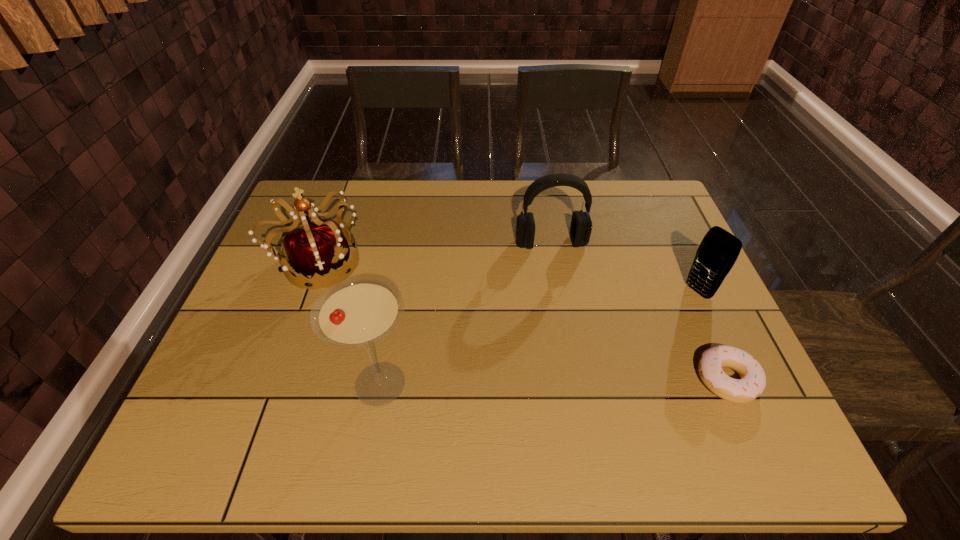
Find the location of a particular element. The width and height of the screenshot is (960, 540). free space on the desktop that is between the fourth object from right to left and the shortest object and is positioned on the front-facing side of the leftmost object is located at coordinates (547, 382).

You are a GUI agent. You are given a task and a screenshot of the screen. Output one action in this format:
    pyautogui.click(x=<x>, y=<y>)
    Task: Click on the free spot on the desktop that is between the fourth object from right to left and the shortest object and is positioned on the screen of the cellular telephone
    Image resolution: width=960 pixels, height=540 pixels.
    Given the screenshot: What is the action you would take?
    pyautogui.click(x=545, y=382)

What are the coordinates of `vacant space on the desktop that is between the martini and the shortest object and is positioned on the headband of the third object from right to left` in the screenshot? It's located at (585, 381).